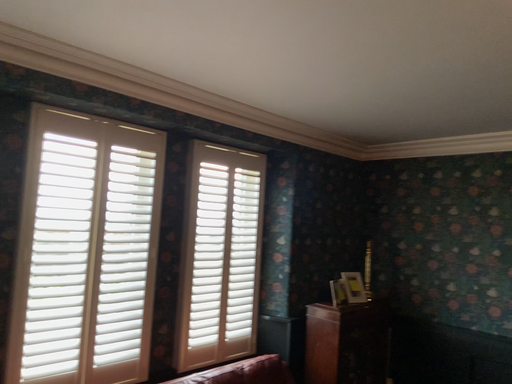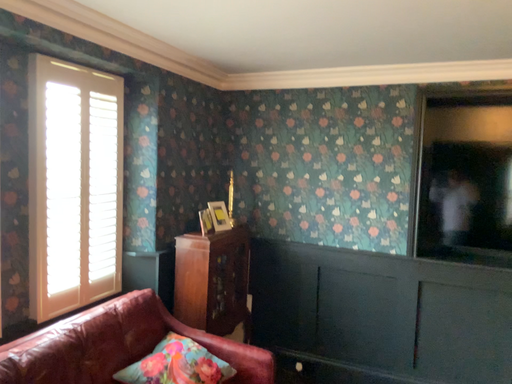
Question: Which way did the camera rotate in the video?

Choices:
 (A) rotated right
 (B) rotated left

Answer: (A)